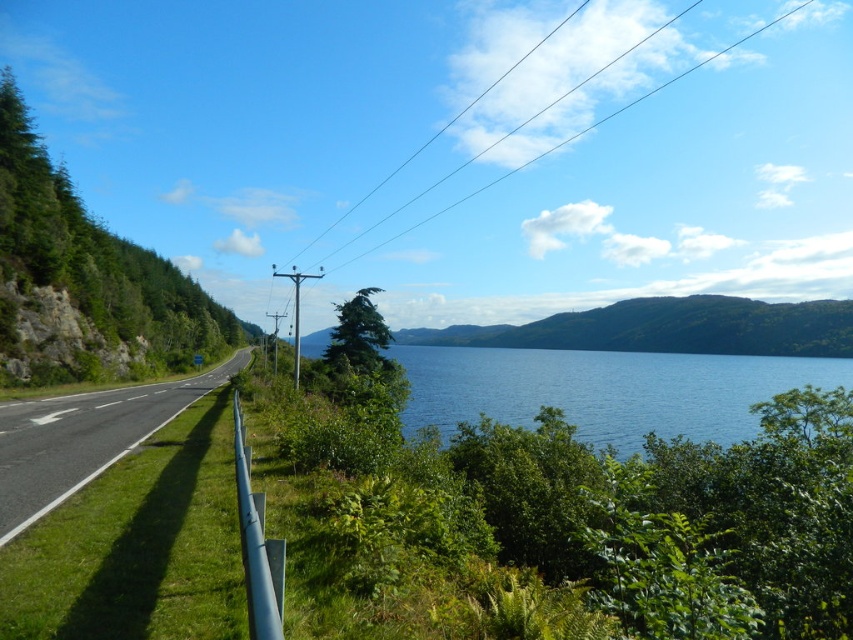
Question: Which is nearer to the black wire at upper center?

Choices:
 (A) blue water at center
 (B) black asphalt highway at left

Answer: (A)

Question: Does blue water at center have a lesser width compared to black asphalt highway at left?

Choices:
 (A) yes
 (B) no

Answer: (B)

Question: Among these objects, which one is farthest from the camera?

Choices:
 (A) black wire at upper center
 (B) blue water at center
 (C) black asphalt highway at left

Answer: (A)

Question: Which object appears farthest from the camera in this image?

Choices:
 (A) black wire at upper center
 (B) blue water at center
 (C) black asphalt highway at left

Answer: (A)

Question: Can you confirm if blue water at center is positioned below black asphalt highway at left?

Choices:
 (A) yes
 (B) no

Answer: (A)

Question: From the image, what is the correct spatial relationship of blue water at center in relation to black asphalt highway at left?

Choices:
 (A) above
 (B) below

Answer: (B)